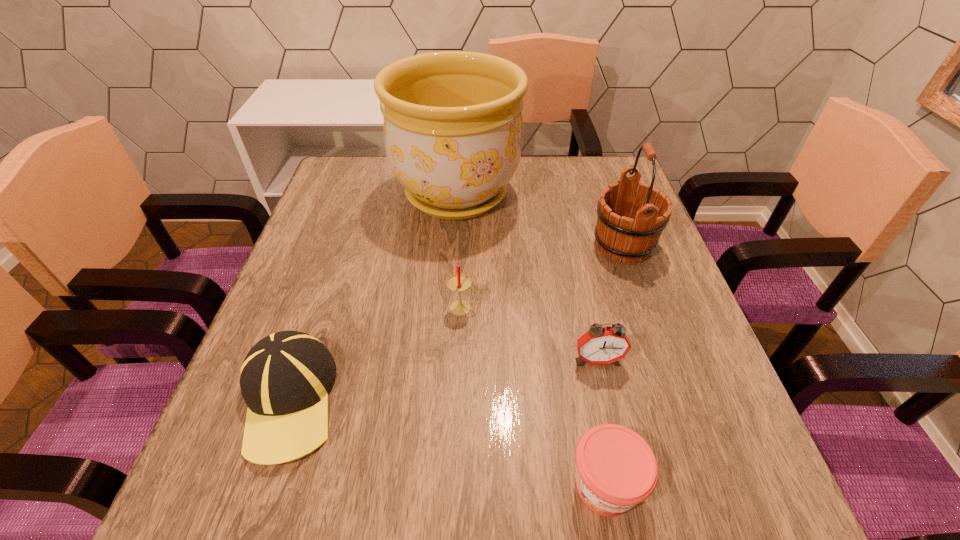
Locate an element on the screen. vacant space located 0.060m with the brim of the baseball cap facing forward is located at coordinates (251, 511).

You are a GUI agent. You are given a task and a screenshot of the screen. Output one action in this format:
    pyautogui.click(x=<x>, y=<y>)
    Task: Click on the object at the far edge
    
    Given the screenshot: What is the action you would take?
    click(452, 120)

This screenshot has height=540, width=960. Identify the location of baseball cap at the near edge. (285, 378).

Find the location of a particular element. jam at the near edge is located at coordinates tap(616, 469).

Find the location of `object that is at the left edge`. object that is at the left edge is located at coordinates (285, 378).

At what (x,y) coordinates should I click in order to perform the action: click on object present at the right edge. Please return your answer as a coordinate pair (x, y). The height and width of the screenshot is (540, 960). Looking at the image, I should click on (631, 238).

This screenshot has width=960, height=540. Find the location of `object positioned at the near left corner`. object positioned at the near left corner is located at coordinates (285, 378).

I want to click on free space at the far edge of the desktop, so [526, 166].

Locate an element on the screen. Image resolution: width=960 pixels, height=540 pixels. vacant region at the near edge of the desktop is located at coordinates (492, 510).

At what (x,y) coordinates should I click in order to perform the action: click on vacant space at the left edge. Please return your answer as a coordinate pair (x, y). The height and width of the screenshot is (540, 960). Looking at the image, I should click on (291, 296).